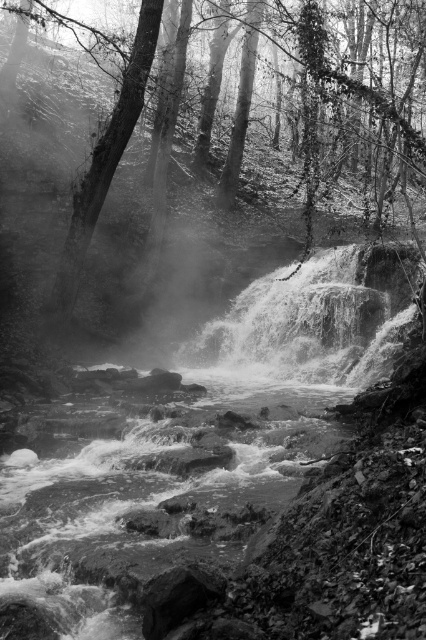
Does smooth bark tree at center lie in front of smooth bark tree at left?

Yes, smooth bark tree at center is in front of smooth bark tree at left.

Who is more forward, (192, 294) or (57, 273)?

Positioned in front is point (57, 273).

You are a GUI agent. You are given a task and a screenshot of the screen. Output one action in this format:
    pyautogui.click(x=<x>, y=<y>)
    Task: Click on the smooth bark tree at center
    
    Given the screenshot: What is the action you would take?
    pyautogui.click(x=129, y=209)